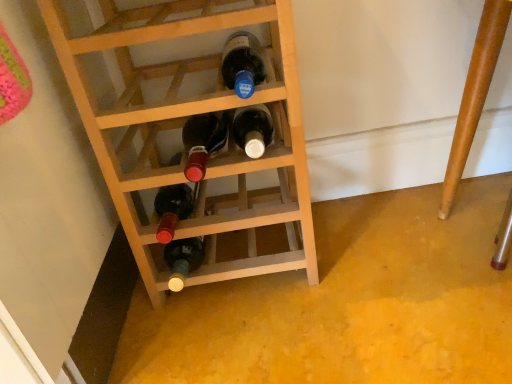
This screenshot has width=512, height=384. Find the location of `vacant region to the right of wooden wine rack at center`. vacant region to the right of wooden wine rack at center is located at coordinates (378, 235).